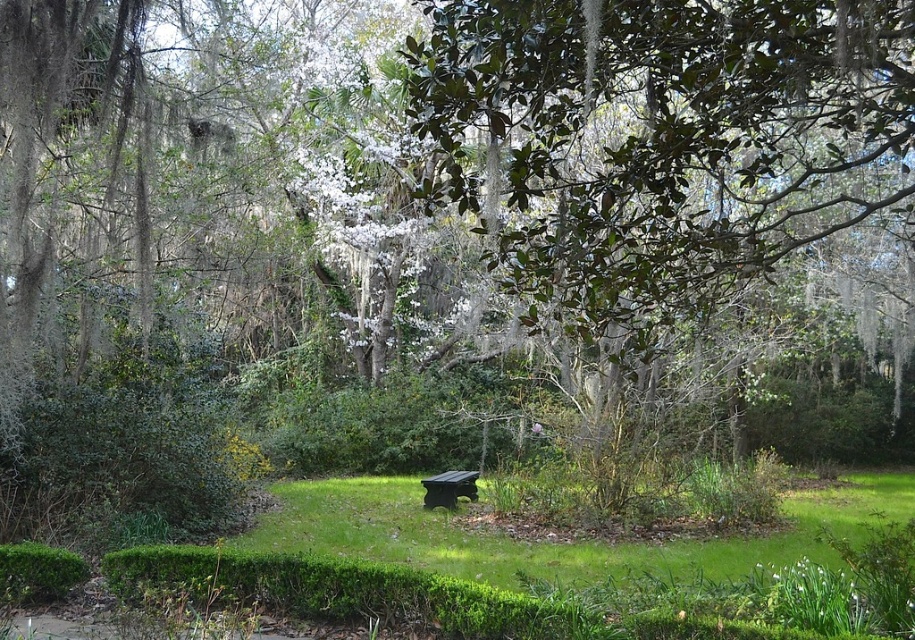
You are planning to place a small garden statue that requires a flat surface. Based on the scene, which area between the green grass at center and the green leafy hedge at center would be more suitable for placing the statue?

The green grass at center has a lesser height compared to the green leafy hedge at center, so the green grass at center would be more suitable for placing the statue as it provides a flatter surface.

Where is the green leafy hedge at center located in the image?

The green leafy hedge at center is located at point [395,426].